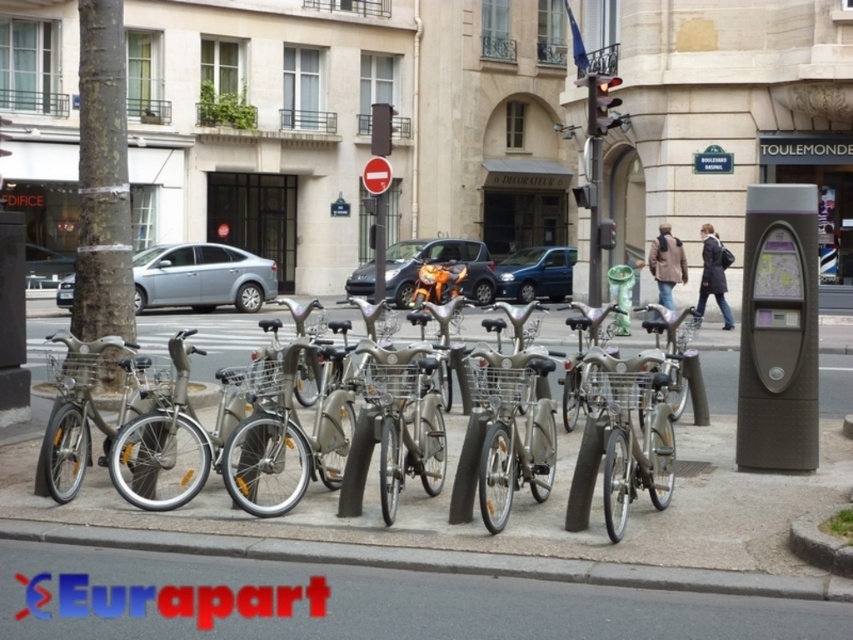
Who is shorter, silver metallic bicycle at center or matte gray parking meter at right?

silver metallic bicycle at center

Measure the distance between silver metallic bicycle at center and matte gray parking meter at right.

silver metallic bicycle at center and matte gray parking meter at right are 1.50 meters apart.

Find the location of a particular element. The width and height of the screenshot is (853, 640). silver metallic bicycle at center is located at coordinates (503, 435).

Between matte gray parking meter at right and gray concrete curb at lower center, which one is positioned higher?

Positioned higher is matte gray parking meter at right.

Is point (793, 292) farther from viewer compared to point (142, 532)?

That is True.

At what (x,y) coordinates should I click in order to perform the action: click on matte gray parking meter at right. Please return your answer as a coordinate pair (x, y). The width and height of the screenshot is (853, 640). Looking at the image, I should click on (778, 332).

Between silver metallic bicycle at center and gray concrete curb at lower center, which one is positioned lower?

gray concrete curb at lower center

Can you confirm if silver metallic bicycle at center is shorter than gray concrete curb at lower center?

Incorrect, silver metallic bicycle at center's height does not fall short of gray concrete curb at lower center's.

Which is in front, point (357, 458) or point (288, 541)?

Point (288, 541)

The image size is (853, 640). In order to click on silver metallic bicycle at center in this screenshot , I will do `click(503, 435)`.